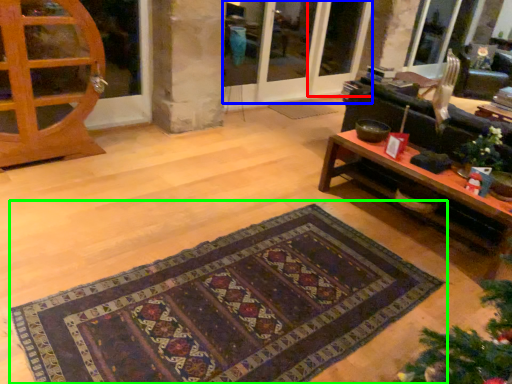
Question: Estimate the real-world distances between objects in this image. Which object is closer to screen door (highlighted by a red box), screen door (highlighted by a blue box) or mat (highlighted by a green box)?

Choices:
 (A) screen door
 (B) mat

Answer: (A)